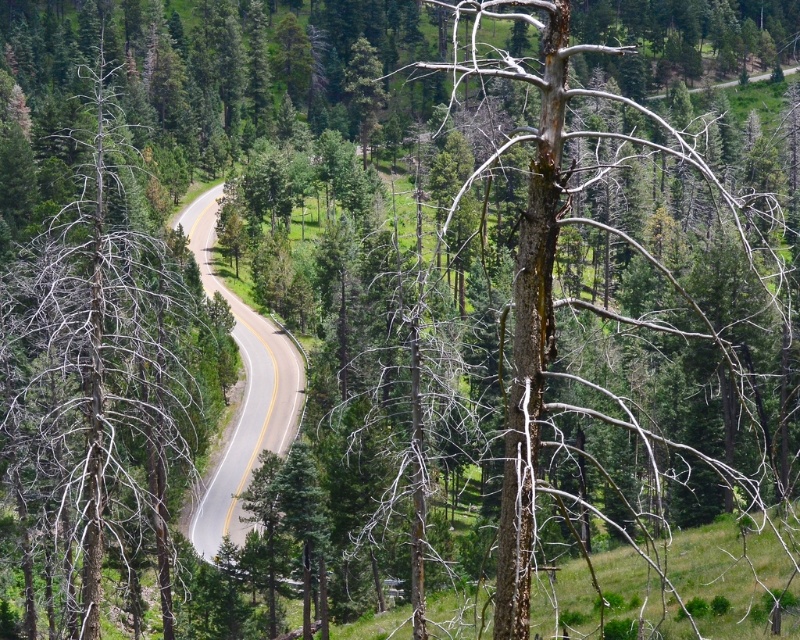
Who is positioned more to the left, dead wood tree at left or asphalt road at center?

dead wood tree at left

Is point (117, 532) in front of point (256, 458)?

Yes, it is.

At what (x,y) coordinates should I click in order to perform the action: click on dead wood tree at left. Please return your answer as a coordinate pair (x, y). Looking at the image, I should click on (97, 352).